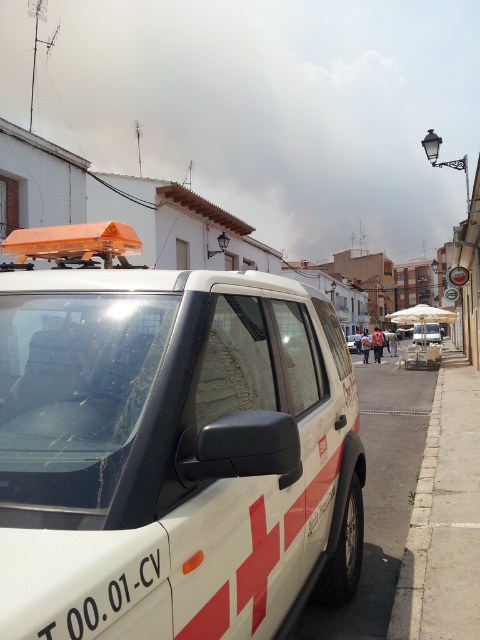
Who is more distant from viewer, (205, 452) or (427, 481)?

Positioned behind is point (427, 481).

Is white matte ambulance at center taller than gray concrete curb at lower right?

Correct, white matte ambulance at center is much taller as gray concrete curb at lower right.

Does point (84, 500) come behind point (419, 586)?

No, (84, 500) is closer to viewer.

The height and width of the screenshot is (640, 480). I want to click on white matte ambulance at center, so click(x=168, y=445).

Which is more to the right, white plastic license plate at center or white matte emergency vehicle at center?

From the viewer's perspective, white matte emergency vehicle at center appears more on the right side.

Between white plastic license plate at center and white matte emergency vehicle at center, which one appears on the left side from the viewer's perspective?

white plastic license plate at center

I want to click on white plastic license plate at center, so click(x=320, y=509).

This screenshot has height=640, width=480. In order to click on white plastic license plate at center in this screenshot , I will do `click(320, 509)`.

Is white matte ambulance at center to the right of transparent glass windshield at center from the viewer's perspective?

Correct, you'll find white matte ambulance at center to the right of transparent glass windshield at center.

Consider the image. Which is above, white matte ambulance at center or transparent glass windshield at center?

Positioned higher is transparent glass windshield at center.

Does point (262, 476) lie in front of point (94, 344)?

No, it is behind (94, 344).

At what (x,y) coordinates should I click in order to perform the action: click on white matte ambulance at center. Please return your answer as a coordinate pair (x, y). Looking at the image, I should click on (168, 445).